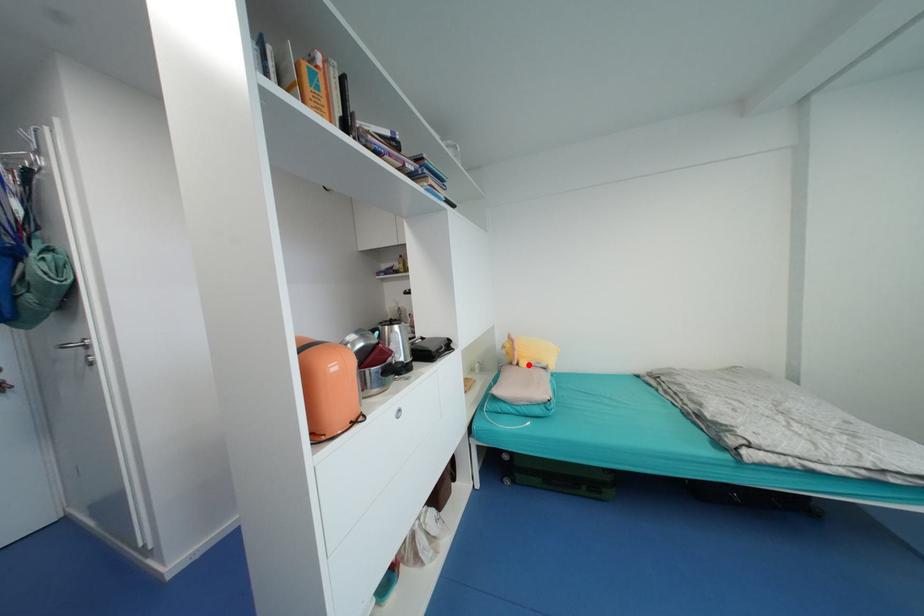
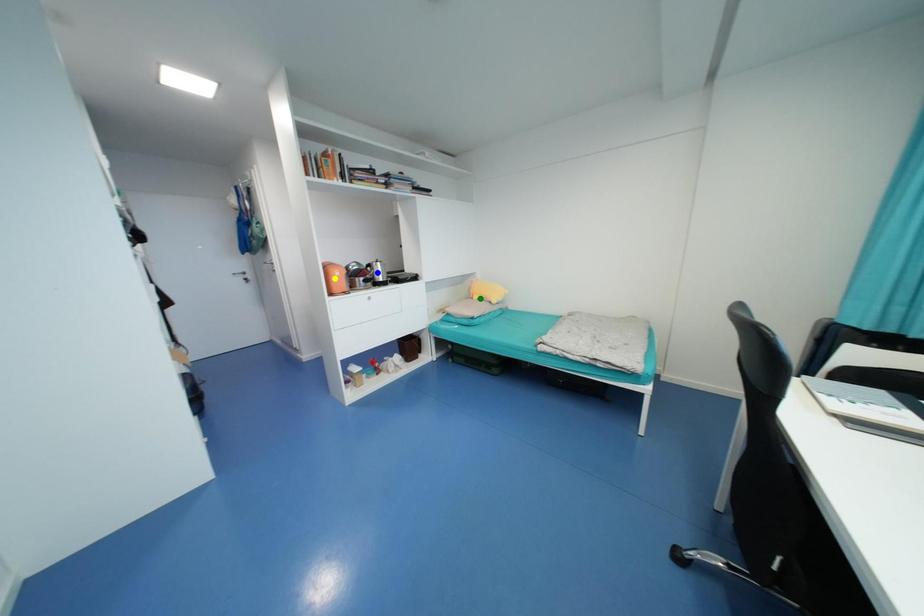
Question: I am providing you with two images of the same scene from different viewpoints. A red point is marked on the first image. You are given multiple points on the second image. Can you choose the point in image 2 that corresponds to the point in image 1?

Choices:
 (A) yellow point
 (B) green point
 (C) blue point

Answer: (B)